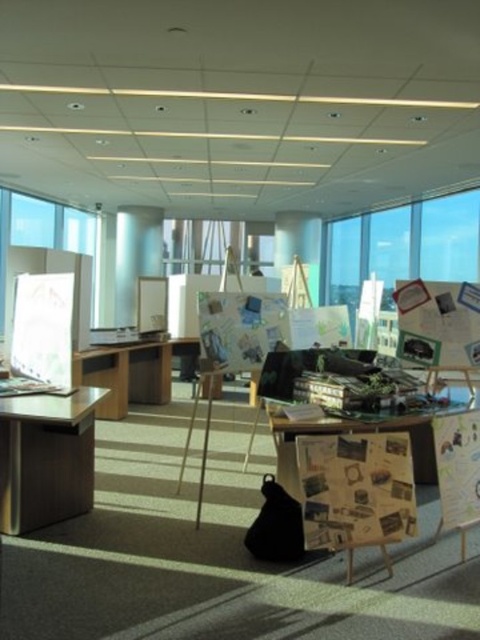
Question: Which point appears farthest from the camera in this image?

Choices:
 (A) (439, 465)
 (B) (71, 444)

Answer: (B)

Question: Which object is positioned closest to the wooden table at left?

Choices:
 (A) wooden bulletin board at center right
 (B) wooden glass table at center

Answer: (B)

Question: Is wooden glass table at center behind wooden bulletin board at center right?

Choices:
 (A) no
 (B) yes

Answer: (A)

Question: Is wooden glass table at center thinner than wooden bulletin board at center right?

Choices:
 (A) yes
 (B) no

Answer: (B)

Question: Estimate the real-world distances between objects in this image. Which object is closer to the wooden table at left?

Choices:
 (A) wooden glass table at center
 (B) transparent glass window at upper left
 (C) wooden bulletin board at center right

Answer: (A)

Question: Can you confirm if wooden glass table at center is wider than wooden bulletin board at center right?

Choices:
 (A) yes
 (B) no

Answer: (A)